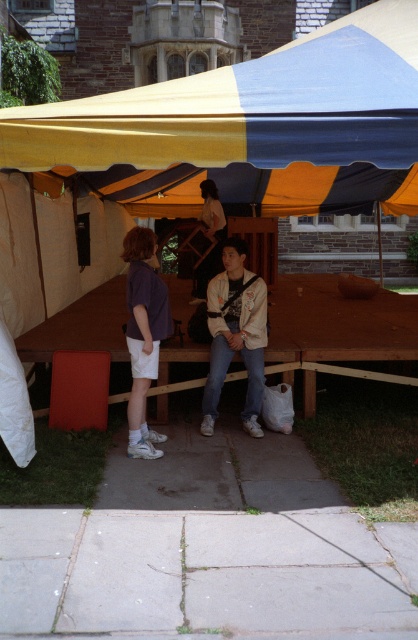
You are planning to set up a new tent for an event. The existing yellow fabric tent at center is located at point 0.200, 0.596. If you want to place your new tent 1.5 meters north of the existing one, what coordinates should you use?

The new tent should be placed at coordinates (249, 128) plus 1.5 meters north. However, without knowing the coordinate system scale, we can only state the relative position as 1.5 meters north of the existing yellow fabric tent at center.

You are standing at the entrance of the yellow fabric tent at center and want to reach the brown wooden picnic table at center. Which direction should you move to get closer to the picnic table?

Since the yellow fabric tent at center is closer to the viewer than the brown wooden picnic table at center, you should move forward away from the tent towards the picnic table to get closer to it.

You are standing at the entrance of the large canopy tent and want to place a new table exactly where the brown wooden picnic table at center is located. What are the coordinates of the spot where you should place the table?

The coordinates for the brown wooden picnic table at center are at point (338, 323), so you should place the new table there.